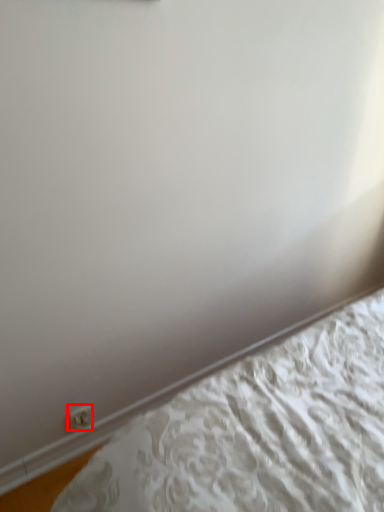
Question: Where is electric outlet (annotated by the red box) located in relation to bed in the image?

Choices:
 (A) right
 (B) left

Answer: (B)